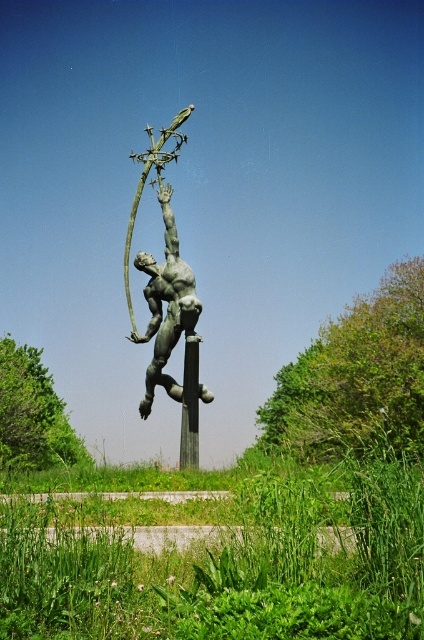
You are a bird flying over the sculpture garden. You want to land on the highest point between the green leafy tree at center and the bronze statue at center. Which one should you choose?

The green leafy tree at center is taller than the bronze statue at center, so you should land on the green leafy tree at center as it has the highest point.

You are standing in front of the sculpture and want to touch the bronze statue at center and the green polished stone pole at center. Which one can you reach first without moving your position?

The bronze statue at center is closer to the viewer than the green polished stone pole at center, so you can reach the bronze statue at center first without moving.